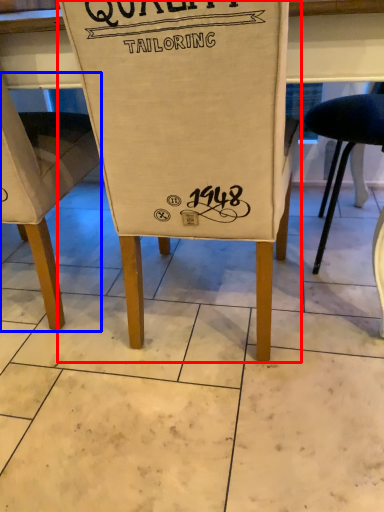
Question: Which object is further to the camera taking this photo, chair (highlighted by a red box) or chair (highlighted by a blue box)?

Choices:
 (A) chair
 (B) chair

Answer: (B)